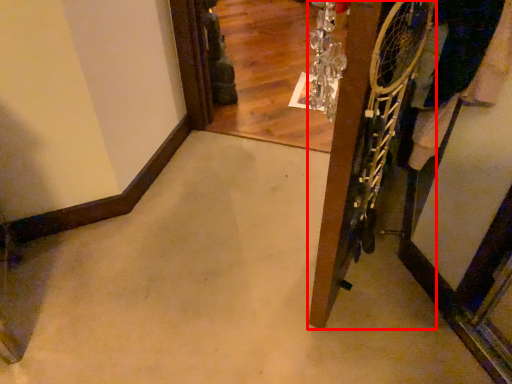
Question: Observing the image, what is the correct spatial positioning of door (annotated by the red box) in reference to clothing?

Choices:
 (A) left
 (B) right

Answer: (A)